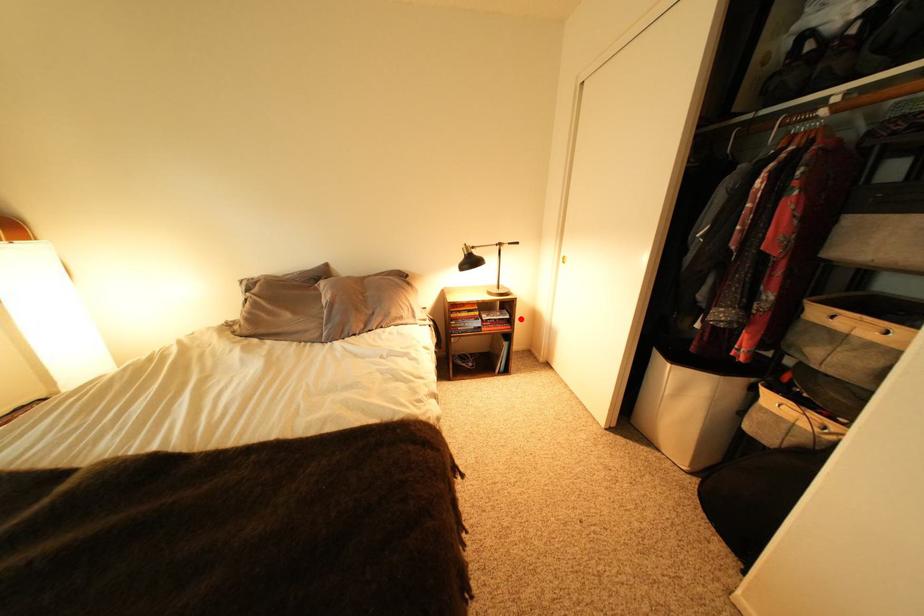
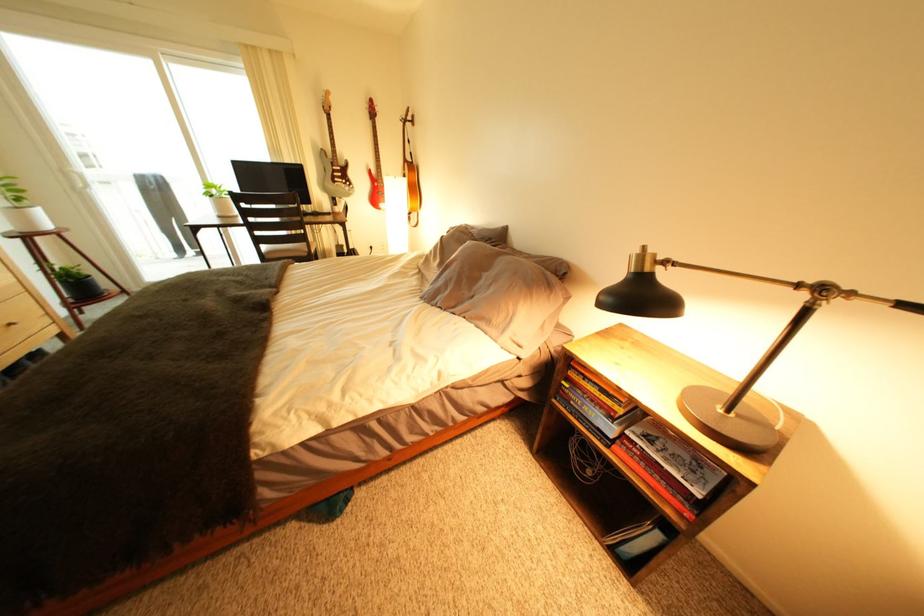
Find the pixel in the second image that matches the highlighted location in the first image.

(712, 496)